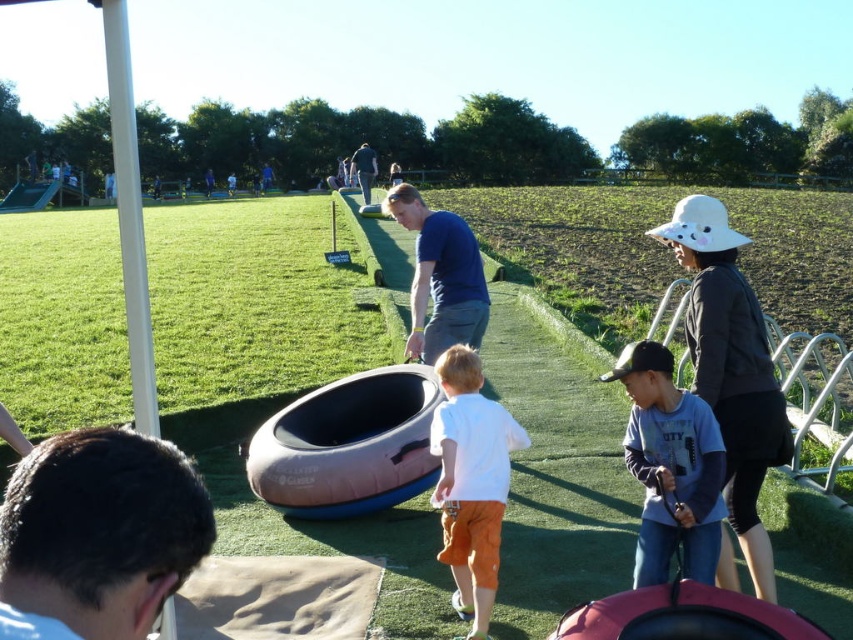
What is located at the point with coordinates (x=670, y=467)?

The point with coordinates (x=670, y=467) corresponds to the gray cotton shirt at center.